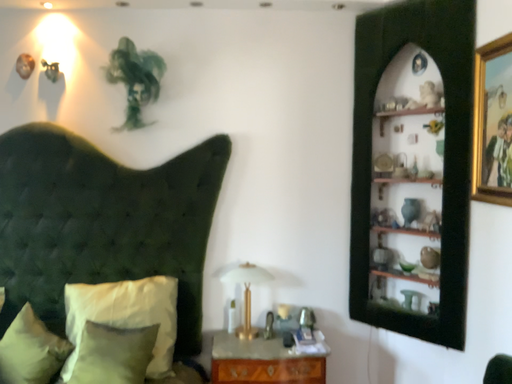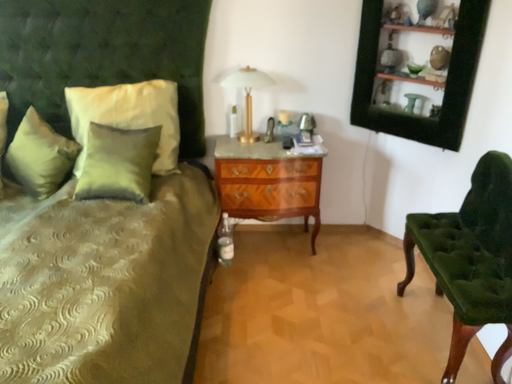
Question: Which way did the camera rotate in the video?

Choices:
 (A) rotated downward
 (B) rotated upward

Answer: (A)